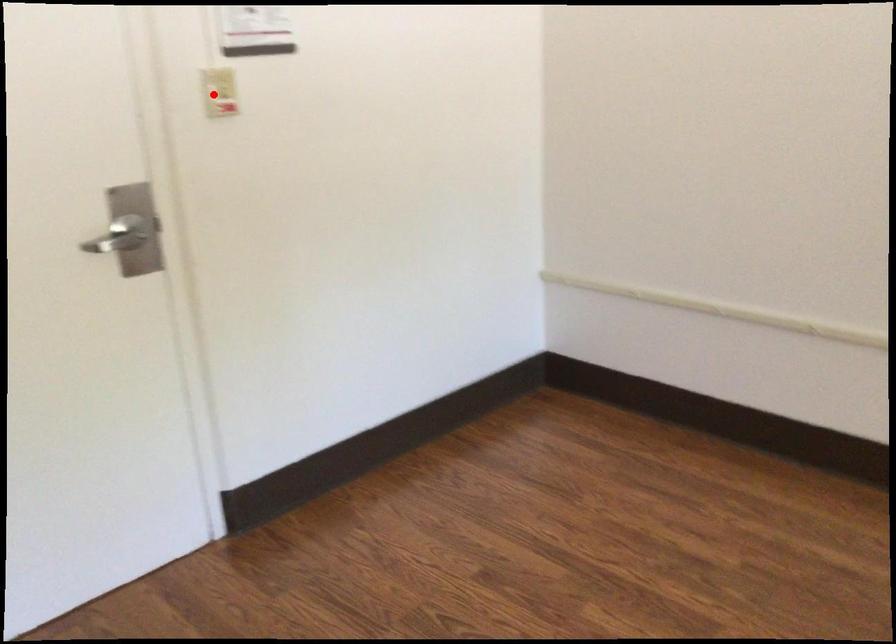
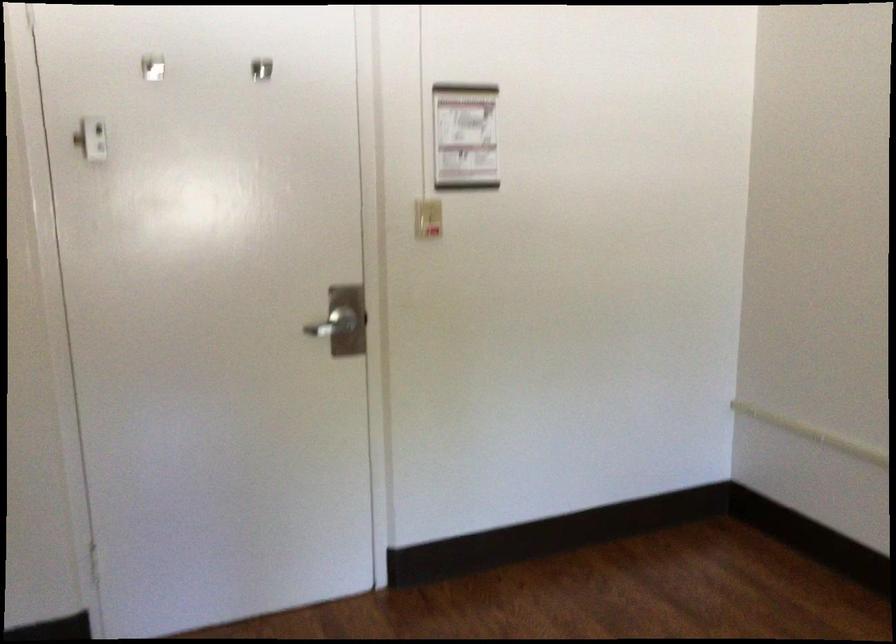
Question: I am providing you with two images of the same scene from different viewpoints. In image1, a red point is highlighted. Considering the same 3D point in image2, which of the following is correct?

Choices:
 (A) It is closer
 (B) It is farther

Answer: (B)